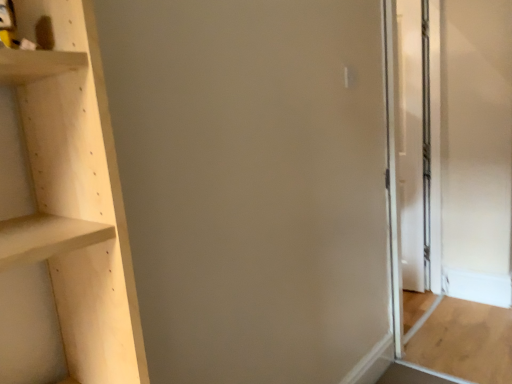
Question: From the image's perspective, is transparent glass screen door at right beneath light brown wood door at right?

Choices:
 (A) yes
 (B) no

Answer: (B)

Question: Is transparent glass screen door at right outside light brown wood door at right?

Choices:
 (A) no
 (B) yes

Answer: (B)

Question: Can you confirm if transparent glass screen door at right is smaller than light brown wood door at right?

Choices:
 (A) no
 (B) yes

Answer: (A)

Question: Is transparent glass screen door at right facing away from light brown wood door at right?

Choices:
 (A) no
 (B) yes

Answer: (A)

Question: From a real-world perspective, is transparent glass screen door at right over light brown wood door at right?

Choices:
 (A) yes
 (B) no

Answer: (A)

Question: Does transparent glass screen door at right have a greater width compared to light brown wood door at right?

Choices:
 (A) yes
 (B) no

Answer: (B)

Question: Can transparent glass screen door at right be found inside light brown wood door at right?

Choices:
 (A) yes
 (B) no

Answer: (B)

Question: From the image's perspective, is light brown wood door at right over transparent glass screen door at right?

Choices:
 (A) yes
 (B) no

Answer: (B)

Question: Are light brown wood door at right and transparent glass screen door at right located far from each other?

Choices:
 (A) yes
 (B) no

Answer: (B)

Question: From a real-world perspective, is light brown wood door at right beneath transparent glass screen door at right?

Choices:
 (A) no
 (B) yes

Answer: (B)

Question: Is light brown wood door at right completely or partially outside of transparent glass screen door at right?

Choices:
 (A) no
 (B) yes

Answer: (B)

Question: Is light brown wood door at right in contact with transparent glass screen door at right?

Choices:
 (A) yes
 (B) no

Answer: (B)

Question: Is light brown wood door at right wider or thinner than transparent glass screen door at right?

Choices:
 (A) thin
 (B) wide

Answer: (B)